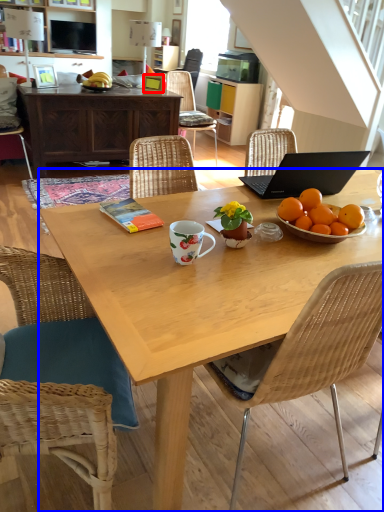
Question: Which object appears closest to the camera in this image, picture frame (highlighted by a red box) or desk (highlighted by a blue box)?

Choices:
 (A) picture frame
 (B) desk

Answer: (B)